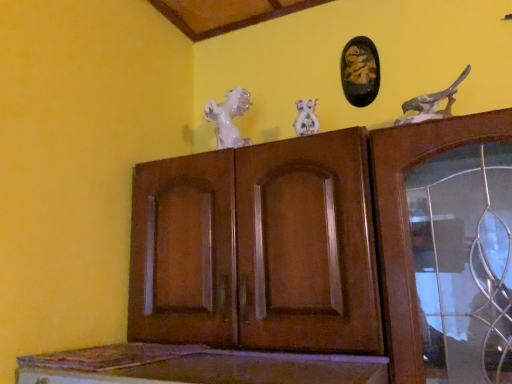
Find the location of `black glossy picture frame at upper center`. black glossy picture frame at upper center is located at coordinates coord(360,71).

In order to face white porcelain horse at upper center, the second animal from the front, should I rotate leftwards or rightwards?

To align with it, rotate left about 4.241°.

What is the approximate height of speckled stone bird at upper right, which appears as the 2th animal when viewed from the back?

speckled stone bird at upper right, which appears as the 2th animal when viewed from the back, is 5.78 inches in height.

Measure the distance between point (446, 97) and camera.

Point (446, 97) is 37.48 inches from camera.

Find the location of a particular element. This screenshot has width=512, height=384. black glossy picture frame at upper center is located at coordinates (360, 71).

From a real-world perspective, is white porcelain horse at upper center, the second animal from the front, above or below black glossy picture frame at upper center?

In terms of real-world spatial position, white porcelain horse at upper center, the second animal from the front, is below black glossy picture frame at upper center.

Who is bigger, white porcelain horse at upper center, acting as the 1th animal starting from the left, or black glossy picture frame at upper center?

With larger size is white porcelain horse at upper center, acting as the 1th animal starting from the left.

Is white porcelain horse at upper center, acting as the 1th animal starting from the left, in front of or behind black glossy picture frame at upper center in the image?

white porcelain horse at upper center, acting as the 1th animal starting from the left, is in front of black glossy picture frame at upper center.

Is white porcelain horse at upper center, arranged as the 1th animal when viewed from the back, next to black glossy picture frame at upper center?

No, white porcelain horse at upper center, arranged as the 1th animal when viewed from the back, is not touching black glossy picture frame at upper center.

Does white porcelain horse at upper center, arranged as the 1th animal when viewed from the back, have a greater height compared to white porcelain dog at center?

Yes, white porcelain horse at upper center, arranged as the 1th animal when viewed from the back, is taller than white porcelain dog at center.

From the image's perspective, is white porcelain horse at upper center, acting as the 1th animal starting from the left, above white porcelain dog at center?

Yes, from the image's perspective, white porcelain horse at upper center, acting as the 1th animal starting from the left, is over white porcelain dog at center.

Consider the image. Considering the relative positions of white porcelain horse at upper center, arranged as the 1th animal when viewed from the back, and white porcelain dog at center in the image provided, is white porcelain horse at upper center, arranged as the 1th animal when viewed from the back, in front of white porcelain dog at center?

No, white porcelain horse at upper center, arranged as the 1th animal when viewed from the back, is behind white porcelain dog at center.

Which point is more distant from viewer, (309, 131) or (447, 114)?

The point (309, 131) is behind.

Can you confirm if white porcelain dog at center is smaller than speckled stone bird at upper right, the first animal in the right-to-left sequence?

Yes, white porcelain dog at center is smaller than speckled stone bird at upper right, the first animal in the right-to-left sequence.

From a real-world perspective, is white porcelain dog at center on speckled stone bird at upper right, the first animal in the right-to-left sequence?

No.

Locate an element on the screen. The height and width of the screenshot is (384, 512). animal sculpture on the left of speckled stone bird at upper right, the first animal in the right-to-left sequence is located at coordinates (306, 118).

Between black glossy picture frame at upper center and speckled stone bird at upper right, which appears as the second animal when viewed from the left, which one has larger size?

speckled stone bird at upper right, which appears as the second animal when viewed from the left.

Where is `picture frame above the speckled stone bird at upper right, which appears as the second animal when viewed from the left (from the image's perspective)`? The image size is (512, 384). picture frame above the speckled stone bird at upper right, which appears as the second animal when viewed from the left (from the image's perspective) is located at coordinates (360, 71).

How different are the orientations of black glossy picture frame at upper center and speckled stone bird at upper right, the first animal in the right-to-left sequence, in degrees?

The angular difference between black glossy picture frame at upper center and speckled stone bird at upper right, the first animal in the right-to-left sequence, is 0.0057 degrees.

Considering the relative sizes of white porcelain dog at center and brown wood cupboard at center in the image provided, is white porcelain dog at center thinner than brown wood cupboard at center?

Correct, the width of white porcelain dog at center is less than that of brown wood cupboard at center.

From the image's perspective, is white porcelain dog at center located beneath brown wood cupboard at center?

No, from the image's perspective, white porcelain dog at center is not below brown wood cupboard at center.

Considering the positions of objects white porcelain dog at center and brown wood cupboard at center in the image provided, who is more to the left, white porcelain dog at center or brown wood cupboard at center?

From the viewer's perspective, brown wood cupboard at center appears more on the left side.

Is white porcelain dog at center closer to camera compared to brown wood cupboard at center?

No, white porcelain dog at center is further to the viewer.

In the scene shown: Can you see brown wood cupboard at center touching white porcelain horse at upper center, arranged as the 1th animal when viewed from the back?

brown wood cupboard at center is not next to white porcelain horse at upper center, arranged as the 1th animal when viewed from the back, and they're not touching.

There is a brown wood cupboard at center. In order to click on the 1st animal above it (from the image's perspective) in this screenshot , I will do `click(229, 118)`.

Considering the relative sizes of brown wood cupboard at center and white porcelain horse at upper center, acting as the 1th animal starting from the left, in the image provided, is brown wood cupboard at center bigger than white porcelain horse at upper center, acting as the 1th animal starting from the left,?

Yes.

From a real-world perspective, is brown wood cupboard at center positioned over white porcelain horse at upper center, arranged as the 1th animal when viewed from the back, based on gravity?

No, from a real-world perspective, brown wood cupboard at center is not over white porcelain horse at upper center, arranged as the 1th animal when viewed from the back

Is white porcelain horse at upper center, acting as the 1th animal starting from the left, smaller than speckled stone bird at upper right, which appears as the 2th animal when viewed from the back?

Correct, white porcelain horse at upper center, acting as the 1th animal starting from the left, occupies less space than speckled stone bird at upper right, which appears as the 2th animal when viewed from the back.

Is white porcelain horse at upper center, acting as the 1th animal starting from the left, next to speckled stone bird at upper right, the first animal in the right-to-left sequence?

There is a gap between white porcelain horse at upper center, acting as the 1th animal starting from the left, and speckled stone bird at upper right, the first animal in the right-to-left sequence.

Is white porcelain horse at upper center, the second animal from the front, facing away from speckled stone bird at upper right, the first animal in the right-to-left sequence?

No, white porcelain horse at upper center, the second animal from the front, is not facing away from speckled stone bird at upper right, the first animal in the right-to-left sequence.

From a real-world perspective, is white porcelain horse at upper center, placed as the second animal when sorted from right to left, located higher than speckled stone bird at upper right, which appears as the second animal when viewed from the left?

Correct, in the physical world, white porcelain horse at upper center, placed as the second animal when sorted from right to left, is higher than speckled stone bird at upper right, which appears as the second animal when viewed from the left.

In order to click on animal that is the 2nd one when counting downward from the black glossy picture frame at upper center (from the image's perspective) in this screenshot , I will do `click(229, 118)`.

The image size is (512, 384). Find the location of `animal behind the white porcelain dog at center`. animal behind the white porcelain dog at center is located at coordinates (229, 118).

Estimate the real-world distances between objects in this image. Which object is further from white porcelain horse at upper center, placed as the second animal when sorted from right to left, white porcelain dog at center or black glossy picture frame at upper center?

Among the two, black glossy picture frame at upper center is located further to white porcelain horse at upper center, placed as the second animal when sorted from right to left.

Considering their positions, is black glossy picture frame at upper center positioned closer to white porcelain horse at upper center, arranged as the 1th animal when viewed from the back, than white porcelain dog at center?

white porcelain dog at center is positioned closer to the anchor white porcelain horse at upper center, arranged as the 1th animal when viewed from the back.

Considering their positions, is speckled stone bird at upper right, arranged as the first animal when viewed from the front, positioned closer to black glossy picture frame at upper center than white porcelain horse at upper center, placed as the second animal when sorted from right to left?

speckled stone bird at upper right, arranged as the first animal when viewed from the front, lies closer to black glossy picture frame at upper center than the other object.

Looking at the image, which one is located further to brown wood cupboard at center, speckled stone bird at upper right, which appears as the second animal when viewed from the left, or white porcelain dog at center?

speckled stone bird at upper right, which appears as the second animal when viewed from the left, is positioned further to the anchor brown wood cupboard at center.

Based on their spatial positions, is white porcelain dog at center or white porcelain horse at upper center, acting as the 1th animal starting from the left, further from speckled stone bird at upper right, arranged as the first animal when viewed from the front?

white porcelain horse at upper center, acting as the 1th animal starting from the left, is positioned further to the anchor speckled stone bird at upper right, arranged as the first animal when viewed from the front.

Which object lies further to the anchor point white porcelain dog at center, speckled stone bird at upper right, which appears as the second animal when viewed from the left, or white porcelain horse at upper center, placed as the second animal when sorted from right to left?

The object further to white porcelain dog at center is speckled stone bird at upper right, which appears as the second animal when viewed from the left.

In the scene shown: When comparing their distances from brown wood cupboard at center, does white porcelain dog at center or black glossy picture frame at upper center seem further?

The object further to brown wood cupboard at center is black glossy picture frame at upper center.

Estimate the real-world distances between objects in this image. Which object is closer to black glossy picture frame at upper center, brown wood cupboard at center or white porcelain horse at upper center, placed as the second animal when sorted from right to left?

Based on the image, white porcelain horse at upper center, placed as the second animal when sorted from right to left, appears to be nearer to black glossy picture frame at upper center.

You are a GUI agent. You are given a task and a screenshot of the screen. Output one action in this format:
    pyautogui.click(x=<x>, y=<y>)
    Task: Click on the cupboard located between white porcelain horse at upper center, acting as the 1th animal starting from the left, and speckled stone bird at upper right, the first animal in the right-to-left sequence, in the left-right direction
    This screenshot has height=384, width=512.
    Given the screenshot: What is the action you would take?
    pyautogui.click(x=336, y=248)

The image size is (512, 384). I want to click on animal sculpture between white porcelain horse at upper center, placed as the second animal when sorted from right to left, and brown wood cupboard at center in the up-down direction, so click(306, 118).

This screenshot has height=384, width=512. In order to click on animal sculpture between white porcelain horse at upper center, arranged as the 1th animal when viewed from the back, and speckled stone bird at upper right, arranged as the first animal when viewed from the front in this screenshot , I will do `click(306, 118)`.

I want to click on animal sculpture located between speckled stone bird at upper right, which appears as the second animal when viewed from the left, and black glossy picture frame at upper center in the depth direction, so click(x=306, y=118).